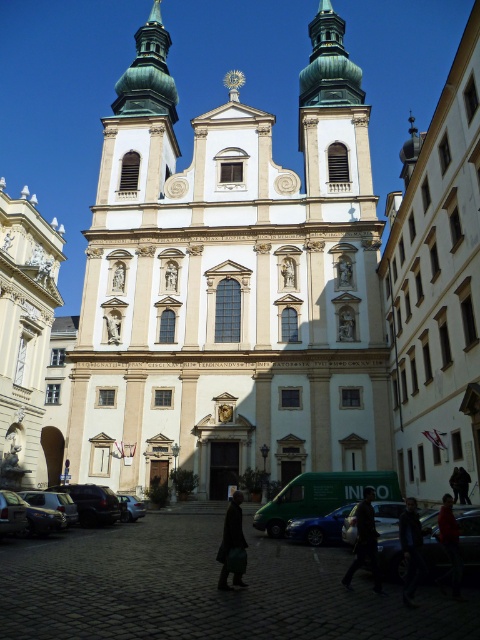
Question: Which point appears closest to the camera in this image?

Choices:
 (A) (467, 500)
 (B) (132, 496)

Answer: (A)

Question: Can you confirm if white stone church at center is wider than beige stone church at left?

Choices:
 (A) yes
 (B) no

Answer: (B)

Question: Which point appears closest to the camera in this image?

Choices:
 (A) (17, 531)
 (B) (361, 529)

Answer: (B)

Question: Considering the relative positions of dark blue jacket at center and shiny black sedan at lower left in the image provided, where is dark blue jacket at center located with respect to shiny black sedan at lower left?

Choices:
 (A) below
 (B) above

Answer: (B)

Question: Which point is closer to the camera taking this photo?

Choices:
 (A) [384, 513]
 (B) [10, 492]

Answer: (A)

Question: Does white stone church at center have a lesser width compared to shiny black sedan at lower right?

Choices:
 (A) yes
 (B) no

Answer: (B)